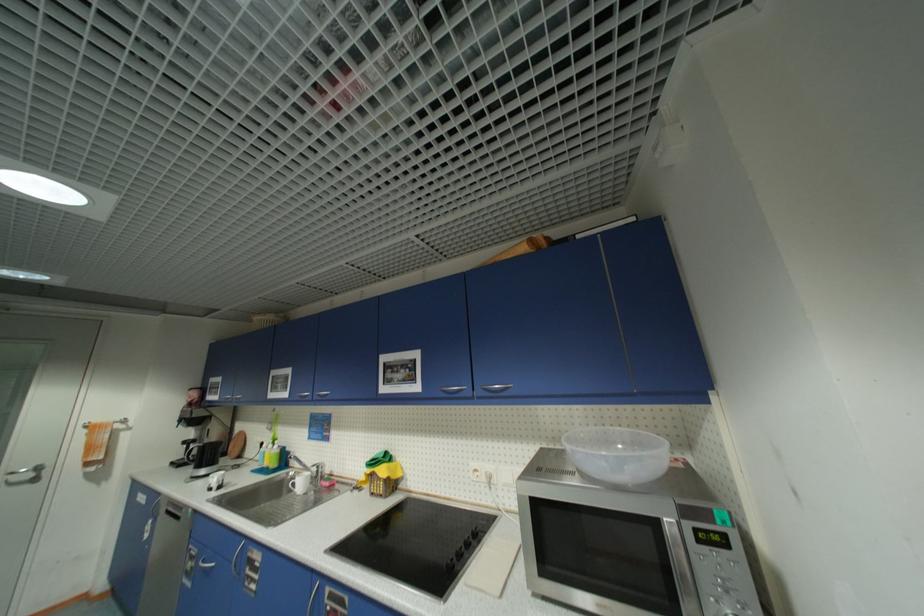
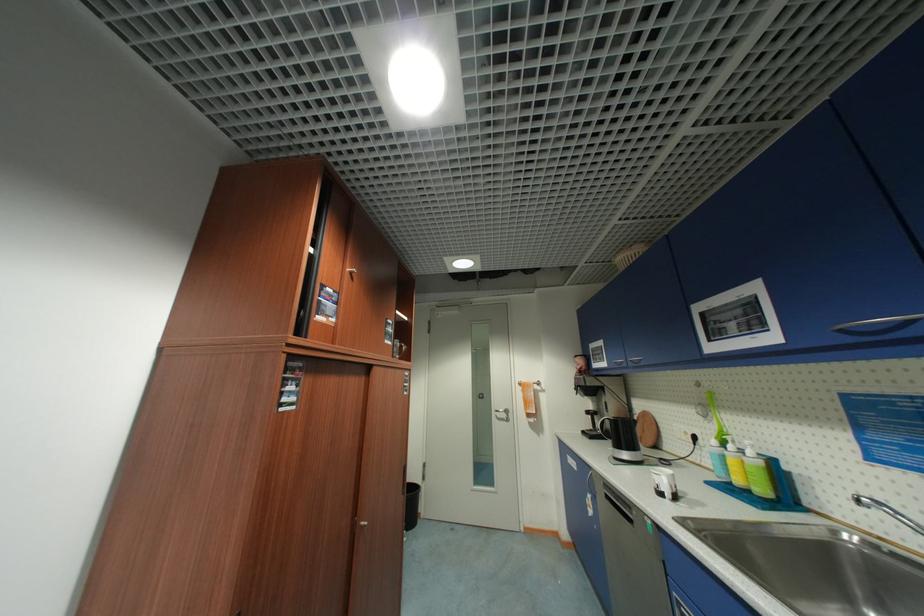
The point at (262, 468) is marked in the first image. Where is the corresponding point in the second image?

(719, 479)